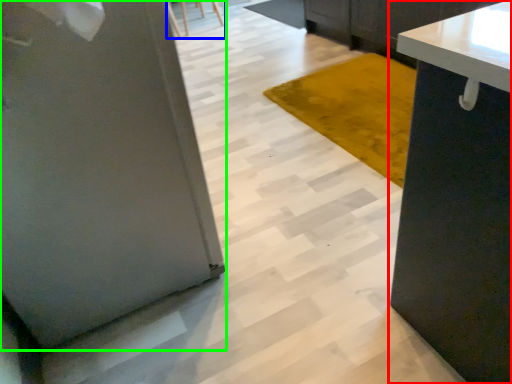
Question: Considering the real-world distances, which object is closest to cabinetry (highlighted by a red box)? chair (highlighted by a blue box) or pillar (highlighted by a green box).

Choices:
 (A) chair
 (B) pillar

Answer: (B)